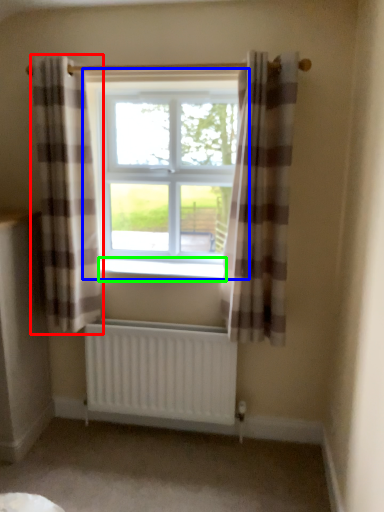
Question: Which object is the farthest from curtain (highlighted by a red box)? Choose among these: window (highlighted by a blue box) or window sill (highlighted by a green box).

Choices:
 (A) window
 (B) window sill

Answer: (B)